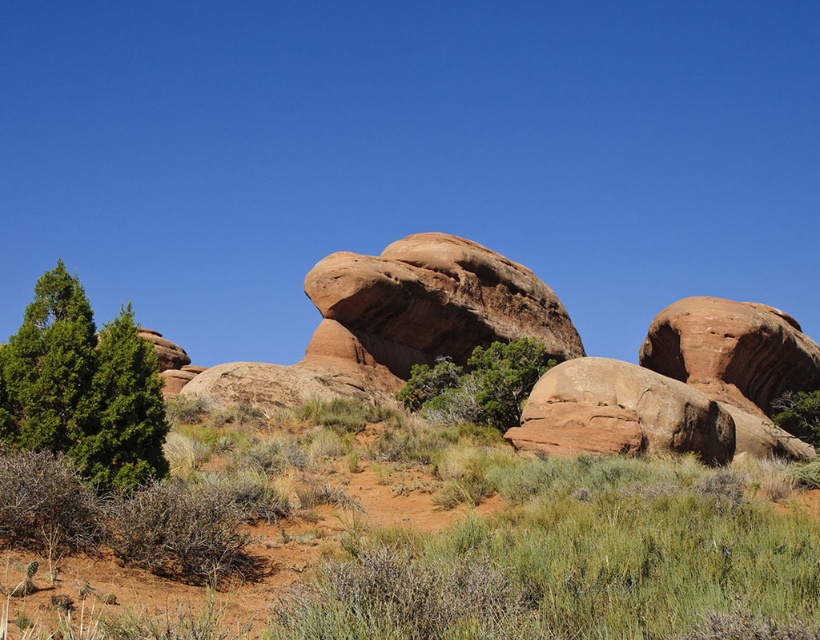
Is green shrubbery at lower left positioned in front of green leafy tree at center?

That is True.

Is point (133, 490) farther from viewer compared to point (475, 416)?

No, it is in front of (475, 416).

Where is `green shrubbery at lower left`? The height and width of the screenshot is (640, 820). green shrubbery at lower left is located at coordinates (406, 538).

Can you confirm if green shrubbery at lower left is wider than rustic sandstone rock at center?

Incorrect, green shrubbery at lower left's width does not surpass rustic sandstone rock at center's.

Based on the photo, which is below, green shrubbery at lower left or rustic sandstone rock at center?

green shrubbery at lower left is below.

Is point (780, 472) in front of point (301, 376)?

Yes, point (780, 472) is in front of point (301, 376).

Locate an element on the screen. The image size is (820, 640). green shrubbery at lower left is located at coordinates (406, 538).

Can you confirm if rustic sandstone rock at center is positioned below green matte tree at left?

Incorrect, rustic sandstone rock at center is not positioned below green matte tree at left.

Is point (474, 248) positioned before point (155, 445)?

No.

At what (x,y) coordinates should I click in order to perform the action: click on rustic sandstone rock at center. Please return your answer as a coordinate pair (x, y). Looking at the image, I should click on (399, 321).